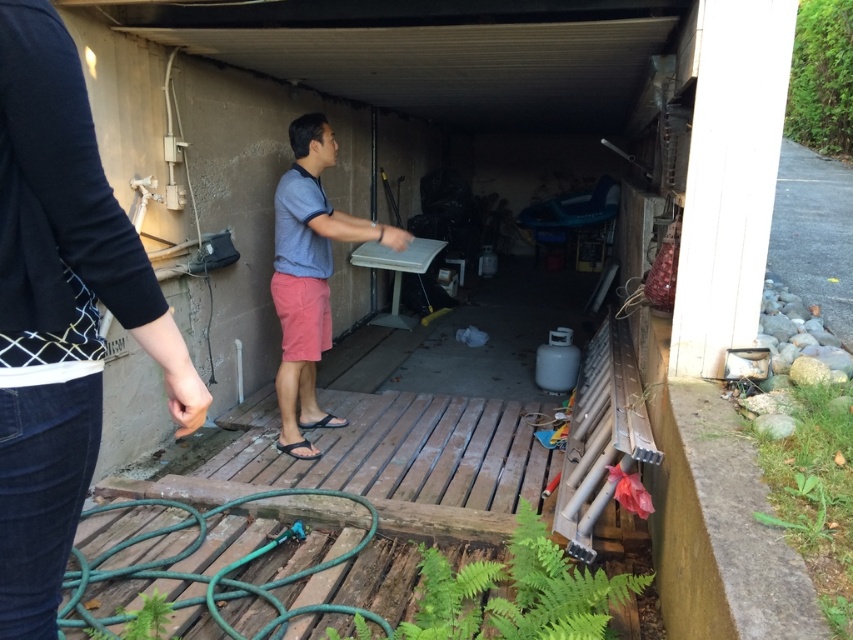
You are standing at the entrance of the utility area and want to locate the black cotton shirt at upper left. According to the coordinates provided, where should you look to find it?

The black cotton shirt at upper left is located at coordinates point [59,310], so you should look towards the upper left area near those coordinates to find it.

You are organizing a clothing storage area and need to place the black cotton shirt at upper left and the gray cotton shirt at center. If you want to place them vertically on a shelf, which one should be placed lower to match their current positions?

The black cotton shirt at upper left should be placed lower on the shelf since it is currently positioned below the gray cotton shirt at center.